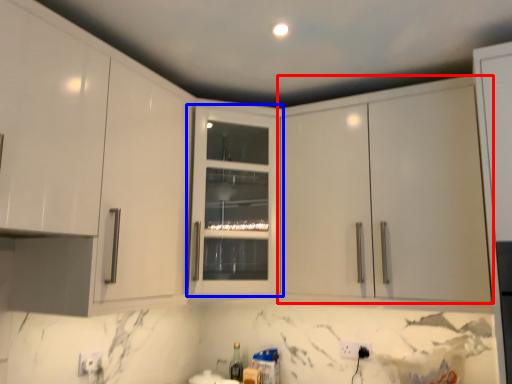
Question: Which object appears farthest to the camera in this image, cabinetry (highlighted by a red box) or cabinetry (highlighted by a blue box)?

Choices:
 (A) cabinetry
 (B) cabinetry

Answer: (B)